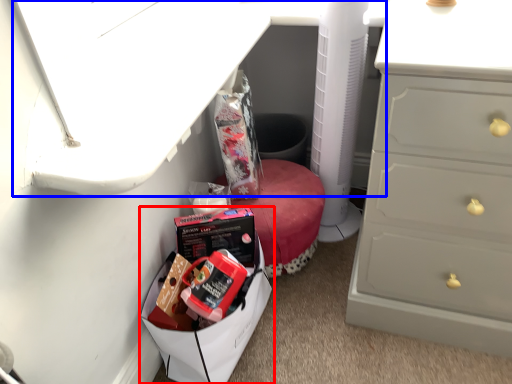
Question: Which object appears closest to the camera in this image, lunch box (highlighted by a red box) or vanity (highlighted by a blue box)?

Choices:
 (A) lunch box
 (B) vanity

Answer: (B)